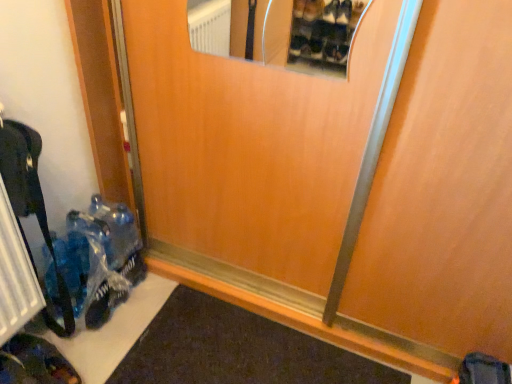
At what (x,y) coordinates should I click in order to perform the action: click on translucent plastic bag at lower left. Please return your answer as a coordinate pair (x, y). The image size is (512, 384). Looking at the image, I should click on (100, 259).

At what (x,y) coordinates should I click in order to perform the action: click on black metal radiator at lower left. Please return your answer as a coordinate pair (x, y). The image size is (512, 384). Looking at the image, I should click on (15, 275).

Where is `wooden door at center`? The width and height of the screenshot is (512, 384). wooden door at center is located at coordinates (260, 153).

This screenshot has height=384, width=512. I want to click on toy that is on the right side of dark brown leather shoe at lower left, so click(x=100, y=259).

Looking at their sizes, would you say dark brown leather shoe at lower left is wider or thinner than translucent plastic bag at lower left?

Clearly, dark brown leather shoe at lower left has more width compared to translucent plastic bag at lower left.

From the image's perspective, which one is positioned higher, dark brown leather shoe at lower left or translucent plastic bag at lower left?

translucent plastic bag at lower left.

From a real-world perspective, is dark brown leather shoe at lower left positioned above or below translucent plastic bag at lower left?

In terms of real-world spatial position, dark brown leather shoe at lower left is below translucent plastic bag at lower left.

Which is in front, point (174, 217) or point (56, 376)?

Point (56, 376)

Are wooden door at center and dark brown leather shoe at lower left making contact?

No, wooden door at center is not with dark brown leather shoe at lower left.

Considering the sizes of wooden door at center and dark brown leather shoe at lower left in the image, is wooden door at center bigger or smaller than dark brown leather shoe at lower left?

wooden door at center is bigger than dark brown leather shoe at lower left.

Is wooden door at center taller than dark brown leather shoe at lower left?

Indeed, wooden door at center has a greater height compared to dark brown leather shoe at lower left.

From the image's perspective, is wooden door at center under translucent plastic bag at lower left?

Actually, wooden door at center appears above translucent plastic bag at lower left in the image.

Is wooden door at center not near translucent plastic bag at lower left?

Actually, wooden door at center and translucent plastic bag at lower left are a little close together.

Which of these two, wooden door at center or translucent plastic bag at lower left, is bigger?

wooden door at center.

Looking at this image, could translucent plastic bag at lower left be considered to be inside wooden door at center?

No.

Which of these two, black metal radiator at lower left or dark brown leather shoe at lower left, is wider?

Wider between the two is dark brown leather shoe at lower left.

Is black metal radiator at lower left smaller than dark brown leather shoe at lower left?

No.

The image size is (512, 384). I want to click on radiator on the left of dark brown leather shoe at lower left, so click(15, 275).

Does point (32, 307) come farther from viewer compared to point (381, 8)?

Yes, it is.

Considering the positions of objects black metal radiator at lower left and wooden door at center in the image provided, who is more to the left, black metal radiator at lower left or wooden door at center?

black metal radiator at lower left.

Is black metal radiator at lower left wider than wooden door at center?

No.

In the scene shown: Can you confirm if black metal radiator at lower left is bigger than wooden door at center?

Incorrect, black metal radiator at lower left is not larger than wooden door at center.

How different are the orientations of dark brown leather shoe at lower left and black metal radiator at lower left in degrees?

6.34 degrees separate the facing orientations of dark brown leather shoe at lower left and black metal radiator at lower left.

Does dark brown leather shoe at lower left have a greater width compared to black metal radiator at lower left?

Indeed, dark brown leather shoe at lower left has a greater width compared to black metal radiator at lower left.

Which object is positioned more to the right, dark brown leather shoe at lower left or black metal radiator at lower left?

Positioned to the right is dark brown leather shoe at lower left.

Is dark brown leather shoe at lower left facing towards black metal radiator at lower left?

No, dark brown leather shoe at lower left is not facing towards black metal radiator at lower left.

Which point is more forward, (120, 226) or (4, 334)?

Point (4, 334)

Based on the photo, which is more to the right, translucent plastic bag at lower left or black metal radiator at lower left?

Positioned to the right is translucent plastic bag at lower left.

Which object is closer to the camera taking this photo, translucent plastic bag at lower left or black metal radiator at lower left?

Positioned in front is black metal radiator at lower left.

Where is `footwear below the translucent plastic bag at lower left (from the image's perspective)`? footwear below the translucent plastic bag at lower left (from the image's perspective) is located at coordinates (34, 362).

You are a GUI agent. You are given a task and a screenshot of the screen. Output one action in this format:
    pyautogui.click(x=<x>, y=<y>)
    Task: Click on the elevator door on the right of the dark brown leather shoe at lower left
    
    Given the screenshot: What is the action you would take?
    pyautogui.click(x=260, y=153)

When comparing their distances from translucent plastic bag at lower left, does wooden door at center or black metal radiator at lower left seem further?

wooden door at center is further to translucent plastic bag at lower left.

Considering their positions, is translucent plastic bag at lower left positioned closer to black metal radiator at lower left than wooden door at center?

translucent plastic bag at lower left lies closer to black metal radiator at lower left than the other object.

From the picture: Considering their positions, is dark brown leather shoe at lower left positioned further to wooden door at center than black metal radiator at lower left?

Among the two, dark brown leather shoe at lower left is located further to wooden door at center.

Looking at this image, which object lies nearer to the anchor point translucent plastic bag at lower left, black metal radiator at lower left or wooden door at center?

Based on the image, black metal radiator at lower left appears to be nearer to translucent plastic bag at lower left.

From the image, which object appears to be nearer to translucent plastic bag at lower left, dark brown leather shoe at lower left or black metal radiator at lower left?

black metal radiator at lower left is positioned closer to the anchor translucent plastic bag at lower left.

From the image, which object appears to be nearer to black metal radiator at lower left, dark brown leather shoe at lower left or translucent plastic bag at lower left?

translucent plastic bag at lower left is positioned closer to the anchor black metal radiator at lower left.

Considering their positions, is dark brown leather shoe at lower left positioned closer to translucent plastic bag at lower left than wooden door at center?

dark brown leather shoe at lower left.

From the image, which object appears to be nearer to translucent plastic bag at lower left, black metal radiator at lower left or dark brown leather shoe at lower left?

black metal radiator at lower left.

Find the location of a particular element. The height and width of the screenshot is (384, 512). toy between black metal radiator at lower left and wooden door at center is located at coordinates (100, 259).

Identify the location of toy between black metal radiator at lower left and dark brown leather shoe at lower left in the vertical direction. The width and height of the screenshot is (512, 384). (100, 259).

You are a GUI agent. You are given a task and a screenshot of the screen. Output one action in this format:
    pyautogui.click(x=<x>, y=<y>)
    Task: Click on the footwear between black metal radiator at lower left and wooden door at center in the horizontal direction
    Image resolution: width=512 pixels, height=384 pixels.
    Given the screenshot: What is the action you would take?
    pyautogui.click(x=34, y=362)

Identify the location of toy between dark brown leather shoe at lower left and wooden door at center from left to right. (100, 259).